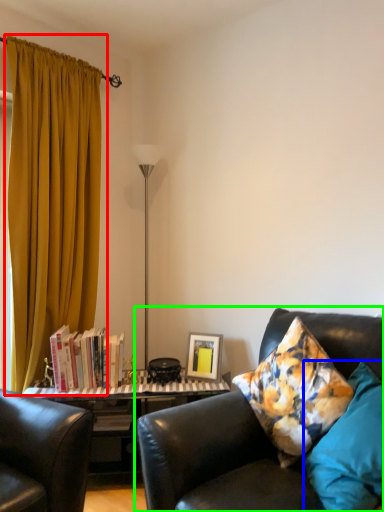
Question: Which object is positioned farthest from curtain (highlighted by a red box)? Select from pillow (highlighted by a blue box) and studio couch (highlighted by a green box).

Choices:
 (A) pillow
 (B) studio couch

Answer: (A)